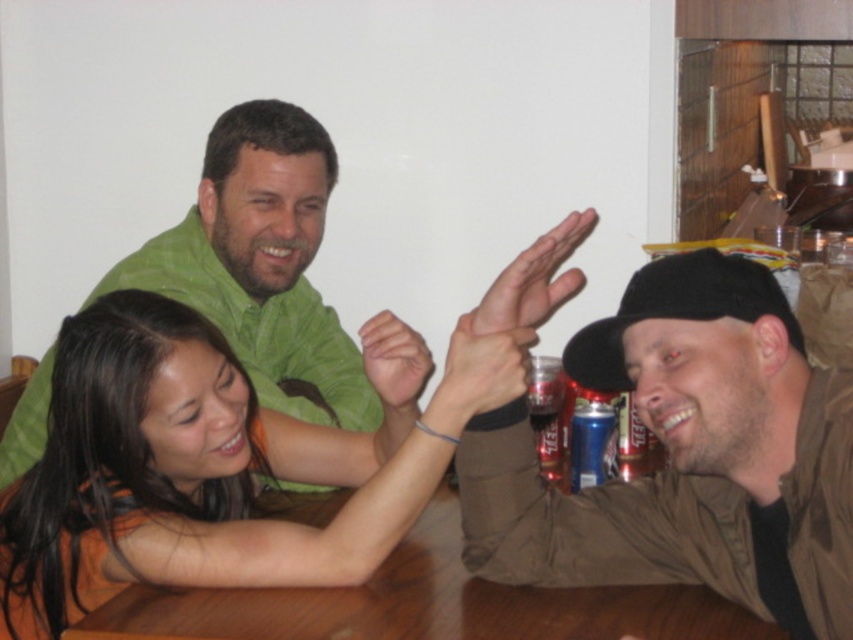
Does green matte shirt at upper left appear under brown wooden table at center?

Incorrect, green matte shirt at upper left is not positioned below brown wooden table at center.

Can you confirm if green matte shirt at upper left is smaller than brown wooden table at center?

Incorrect, green matte shirt at upper left is not smaller in size than brown wooden table at center.

Is point (19, 413) behind point (167, 632)?

Yes, it is behind point (167, 632).

The height and width of the screenshot is (640, 853). Find the location of `green matte shirt at upper left`. green matte shirt at upper left is located at coordinates (263, 264).

Does orange fabric shirt at center have a lesser height compared to brown wooden table at center?

In fact, orange fabric shirt at center may be taller than brown wooden table at center.

Is orange fabric shirt at center smaller than brown wooden table at center?

Incorrect, orange fabric shirt at center is not smaller in size than brown wooden table at center.

What do you see at coordinates (209, 465) in the screenshot?
I see `orange fabric shirt at center` at bounding box center [209, 465].

This screenshot has width=853, height=640. Identify the location of orange fabric shirt at center. (209, 465).

How far apart are orange fabric shirt at center and green matte shirt at upper left?

They are 11.79 inches apart.

Does orange fabric shirt at center have a lesser width compared to green matte shirt at upper left?

Indeed, orange fabric shirt at center has a lesser width compared to green matte shirt at upper left.

You are a GUI agent. You are given a task and a screenshot of the screen. Output one action in this format:
    pyautogui.click(x=<x>, y=<y>)
    Task: Click on the orange fabric shirt at center
    Image resolution: width=853 pixels, height=640 pixels.
    Given the screenshot: What is the action you would take?
    pyautogui.click(x=209, y=465)